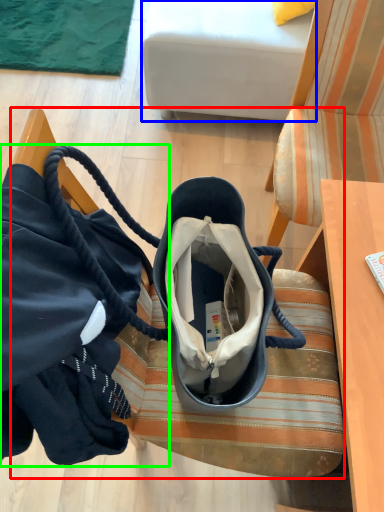
Question: Which object is positioned farthest from furniture (highlighted by a red box)? Select from studio couch (highlighted by a blue box) and handbag (highlighted by a green box).

Choices:
 (A) studio couch
 (B) handbag

Answer: (A)